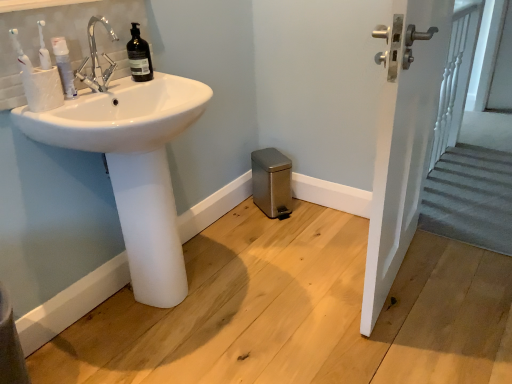
Question: From a real-world perspective, is white matte toothpaste tube at left positioned above or below white glossy door handle at upper right?

Choices:
 (A) above
 (B) below

Answer: (A)

Question: Considering their positions, is white matte toothpaste tube at left located in front of or behind white glossy door handle at upper right?

Choices:
 (A) front
 (B) behind

Answer: (B)

Question: Estimate the real-world distances between objects in this image. Which object is closer to the black matte bottle at upper left?

Choices:
 (A) white matte toothpaste tube at left
 (B) white glossy door handle at upper right
 (C) white textured cup at left
 (D) satin silver trash can at lower center
 (E) white glossy sink at left

Answer: (A)

Question: Estimate the real-world distances between objects in this image. Which object is closer to the satin silver trash can at lower center?

Choices:
 (A) white textured cup at left
 (B) white glossy sink at left
 (C) white glossy door handle at upper right
 (D) white matte toothpaste tube at left
 (E) black matte bottle at upper left

Answer: (C)